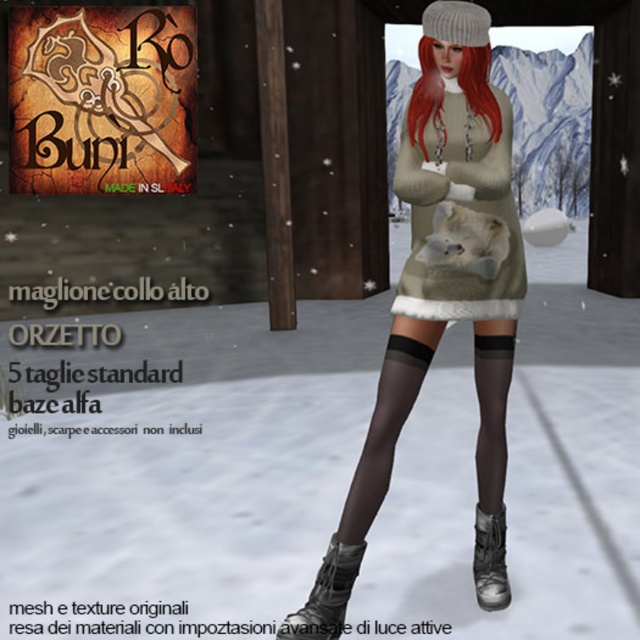
Does point (502, 269) lie in front of point (484, 525)?

Yes.

The height and width of the screenshot is (640, 640). I want to click on fuzzy beige sweater at center, so click(435, 288).

Can you confirm if fuzzy beige sweater at center is wider than leather boots at lower center?

Correct, the width of fuzzy beige sweater at center exceeds that of leather boots at lower center.

Is point (442, 132) less distant than point (340, 621)?

No, it is not.

Where is `fuzzy beige sweater at center`? The image size is (640, 640). fuzzy beige sweater at center is located at coordinates (435, 288).

Based on the photo, how far apart are white fluffy snow at center and fuzzy beige sweater at center?

white fluffy snow at center is 1.80 meters from fuzzy beige sweater at center.

In the scene shown: Who is lower down, white fluffy snow at center or fuzzy beige sweater at center?

white fluffy snow at center is below.

Image resolution: width=640 pixels, height=640 pixels. Find the location of `white fluffy snow at center`. white fluffy snow at center is located at coordinates (182, 460).